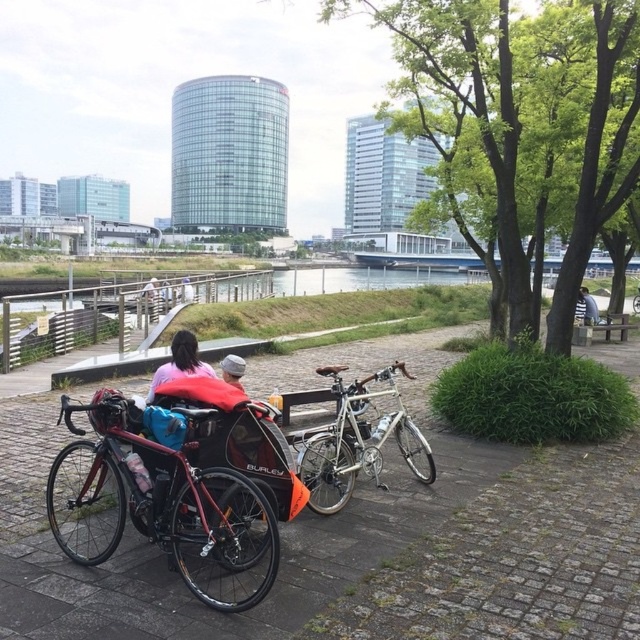
You are standing at the point marked by the coordinates point (356, 440) in the image. Looking around, you see the silver metallic bicycle at center. Which direction should you face to see the red Burley cargo bike with child seat?

The silver metallic bicycle at center is located at point (356, 440). To see the red Burley cargo bike with child seat, you should face towards the left or right direction since it is positioned on the opposite side of the silver metallic bicycle at center along the paved pathway.

You are standing on the paved pathway and want to pick up the blue fabric backpack at center without moving the silver metallic bicycle at center. Is this possible?

The silver metallic bicycle at center is closer to the viewer than the blue fabric backpack at center, so you can reach the blue fabric backpack at center without moving the bicycle.